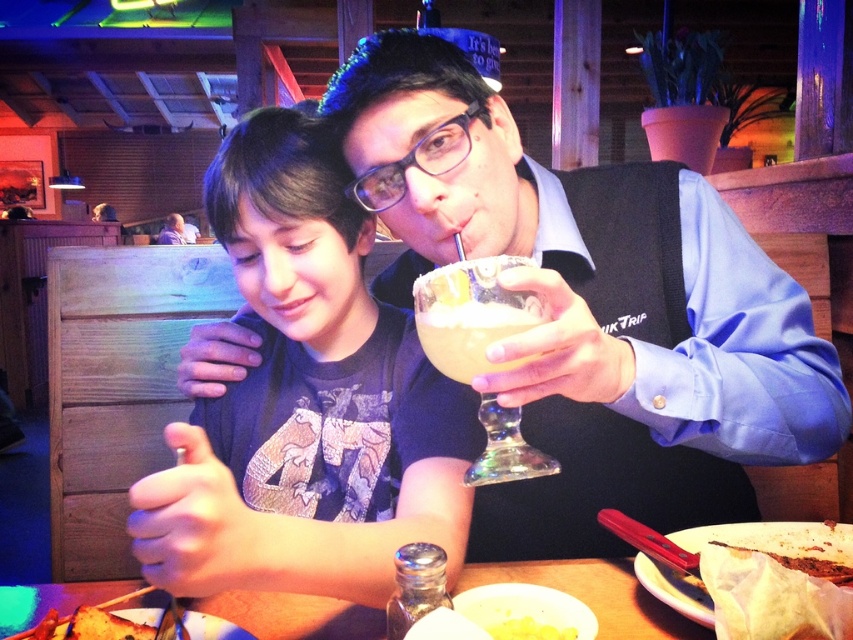
Question: Where is translucent glass margarita at center located in relation to yellow frothy drink at center in the image?

Choices:
 (A) left
 (B) right

Answer: (B)

Question: Can you confirm if wooden table at center is wider than white creamy bread at lower right?

Choices:
 (A) yes
 (B) no

Answer: (A)

Question: Which object is positioned farthest from the matte glass drink at center?

Choices:
 (A) matte black shirt at center
 (B) translucent glass margarita at center

Answer: (B)

Question: Does yellow frothy drink at center appear on the right side of white creamy bread at lower right?

Choices:
 (A) no
 (B) yes

Answer: (A)

Question: Which object appears closest to the camera in this image?

Choices:
 (A) golden crispy bread at lower left
 (B) matte glass drink at center
 (C) translucent glass margarita at center

Answer: (A)

Question: Which point is closer to the camera?

Choices:
 (A) (438, 336)
 (B) (204, 467)
 (C) (556, 561)

Answer: (B)